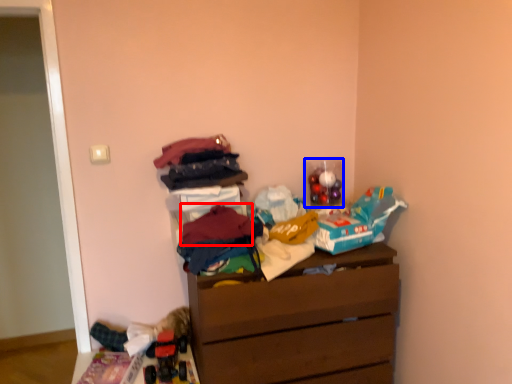
Question: Which object is further to the camera taking this photo, clothing (highlighted by a red box) or toy (highlighted by a blue box)?

Choices:
 (A) clothing
 (B) toy

Answer: (B)